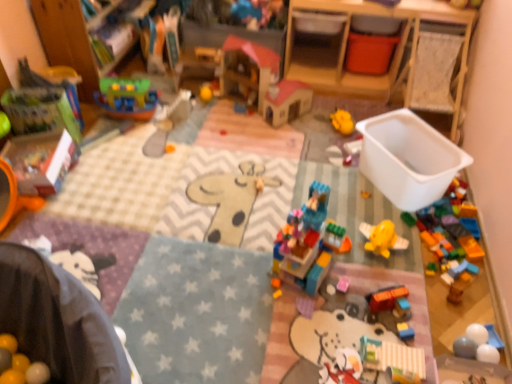
Locate an element on the screen. The height and width of the screenshot is (384, 512). vacant space behind orange matte car at center, arranged as the ninth toy when viewed from the top is located at coordinates (380, 270).